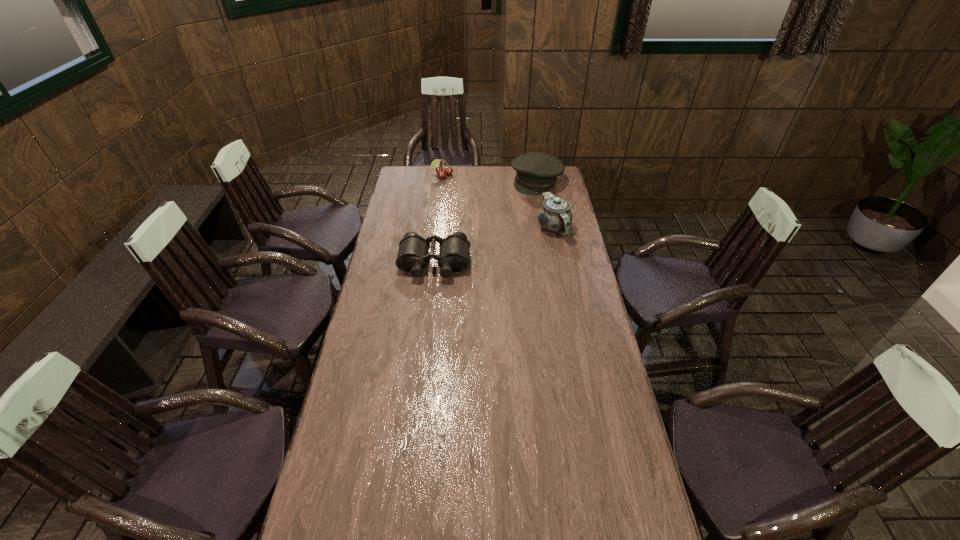
Where is `vacant area at the left edge of the desktop`? vacant area at the left edge of the desktop is located at coordinates (375, 279).

Find the location of a particular element. The height and width of the screenshot is (540, 960). vacant space at the right edge of the desktop is located at coordinates (588, 492).

Where is `free region at the far left corner`? Image resolution: width=960 pixels, height=540 pixels. free region at the far left corner is located at coordinates (400, 173).

Locate an element on the screen. Image resolution: width=960 pixels, height=540 pixels. empty space that is in between the nearest object and the second nearest object is located at coordinates (494, 246).

The width and height of the screenshot is (960, 540). Find the location of `free space between the binoculars and the cherry`. free space between the binoculars and the cherry is located at coordinates (439, 220).

Find the location of a particular element. The image size is (960, 540). free point between the beret and the binoculars is located at coordinates (486, 222).

Locate an element on the screen. blank region between the binoculars and the cherry is located at coordinates (439, 220).

The height and width of the screenshot is (540, 960). I want to click on empty location between the beret and the binoculars, so click(x=486, y=222).

Where is `empty location between the second nearest object and the cherry`? empty location between the second nearest object and the cherry is located at coordinates (498, 202).

You are a GUI agent. You are given a task and a screenshot of the screen. Output one action in this format:
    pyautogui.click(x=<x>, y=<y>)
    Task: Click on the vacant point located between the nearest object and the cherry
    Image resolution: width=960 pixels, height=540 pixels.
    Given the screenshot: What is the action you would take?
    pyautogui.click(x=439, y=220)